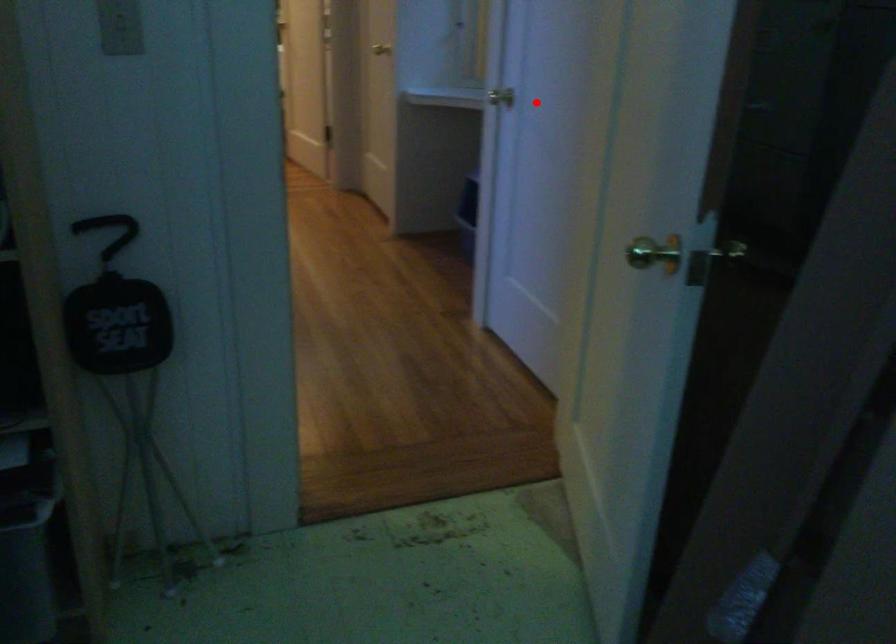
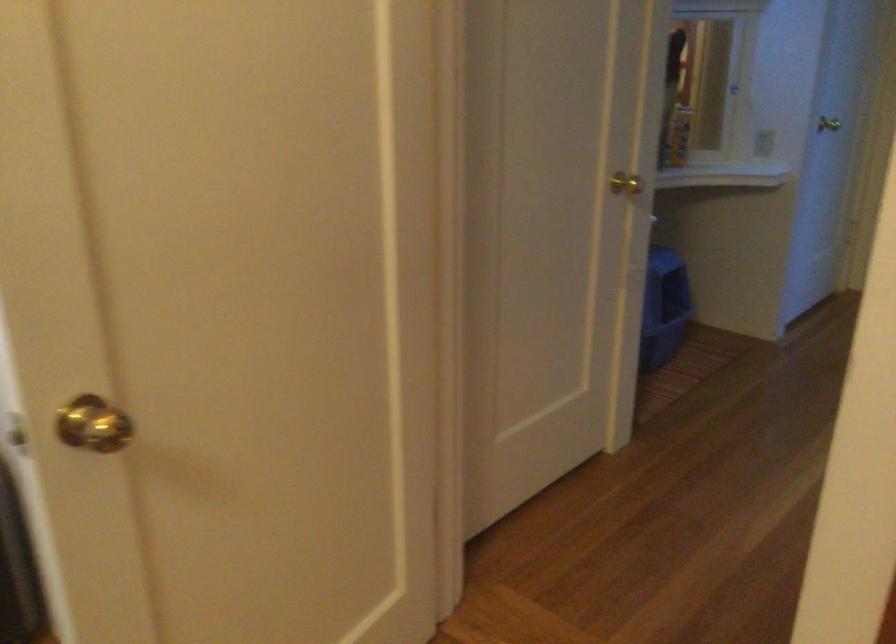
Question: I am providing you with two images of the same scene from different viewpoints. A red point is shown in image1. For the corresponding object point in image2, is it positioned nearer or farther from the camera?

Choices:
 (A) Nearer
 (B) Farther

Answer: (B)